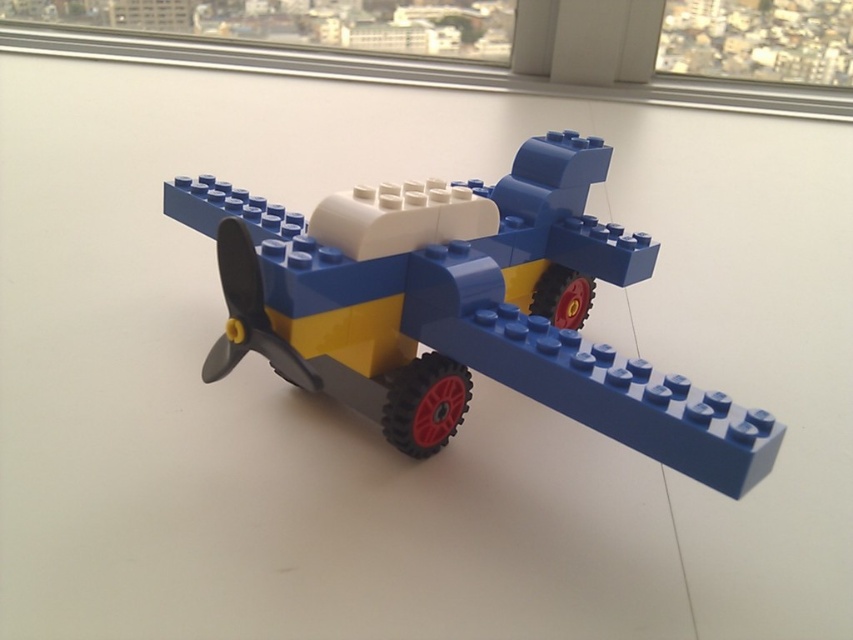
You are standing in front of a LEGO airplane display. You notice a point at coordinates (461,307). What object is located at that point?

The point at coordinates (461,307) marks the blue plastic airplane at center.

You are a child who wants to place a toy airplane on the table so it won not fall off the edge. The table has a transparent glass window at upper right. Where should you place the blue plastic airplane at center to avoid it falling off the edge?

You should place the blue plastic airplane at center away from the edge near the transparent glass window at upper right to prevent it from falling off.

You are a photographer trying to capture the blue plastic airplane at center without any background distractions. Since the transparent glass window at upper right is visible behind it, would adjusting your camera angle allow you to frame the airplane so that the window isn

The blue plastic airplane at center is in front of the transparent glass window at upper right, so by positioning the camera to focus on the airplane and blur or avoid the window area behind it, you can effectively minimize the window in the background. This adjustment would help in capturing the airplane without the window being a distraction.